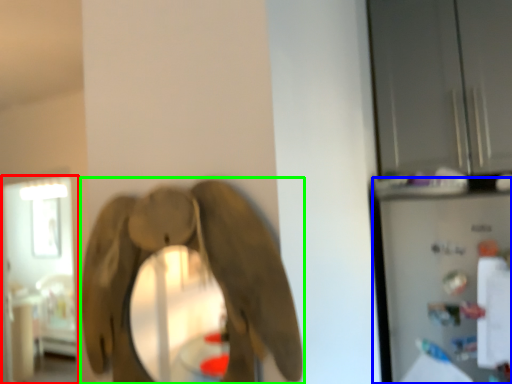
Question: Considering the real-world distances, which object is closest to glass door (highlighted by a red box)? appliance (highlighted by a blue box) or elephant (highlighted by a green box).

Choices:
 (A) appliance
 (B) elephant

Answer: (A)